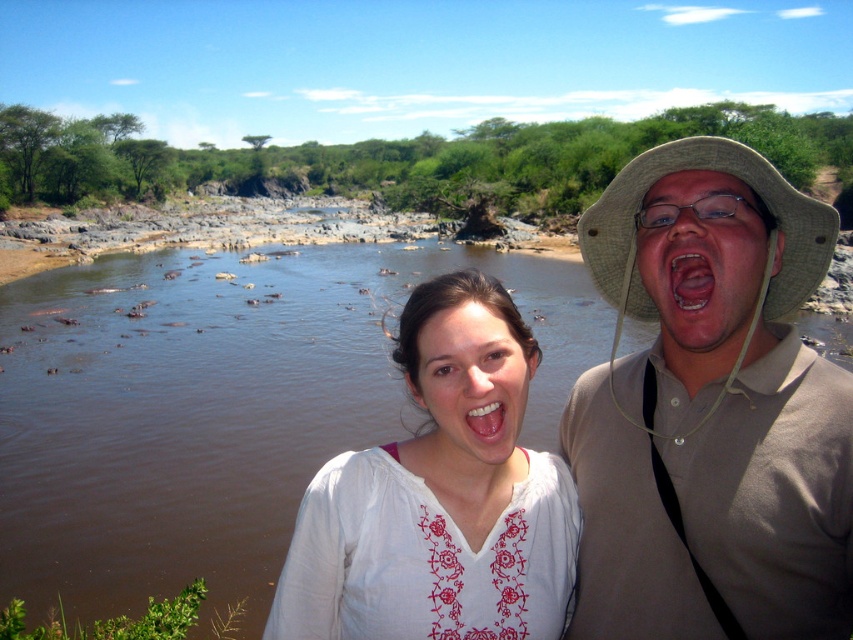
You are a photographer trying to capture both the tan woven hat at upper right and the matte khaki hat at center in a single frame. Given their sizes in the image, which hat will appear smaller in the photo?

The tan woven hat at upper right will appear smaller in the photo because it occupies less space than the matte khaki hat at center.

You are trying to decide which hat to choose based on height. You need a taller hat for a costume party. Which one should you pick between the tan woven hat at upper right and the matte khaki hat at center?

The matte khaki hat at center is taller than the tan woven hat at upper right, so you should choose the matte khaki hat at center for the costume party.